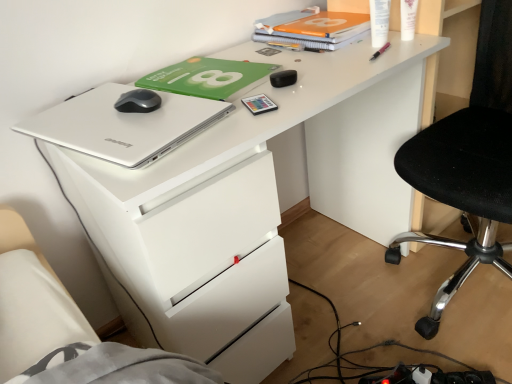
Locate an element on the screen. The height and width of the screenshot is (384, 512). free space that is in between matte plastic card at center, placed as the 5th stationery when sorted from right to left, and pink plastic pen at upper right, which appears as the third stationery when viewed from the top is located at coordinates (323, 77).